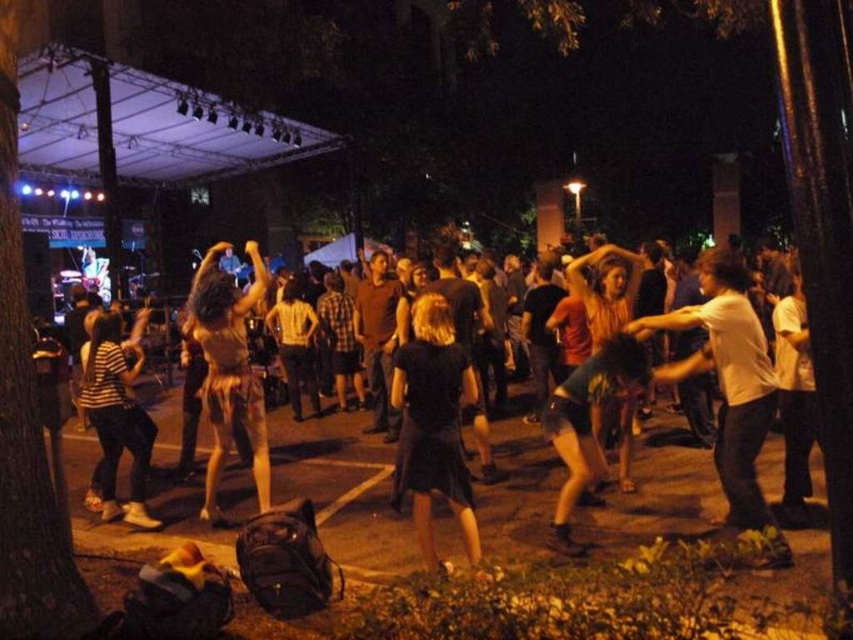
From the picture: You are standing at the center of the stage and want to find the white cotton shirt at right. In which direction should you look to see it?

The white cotton shirt at right is located at coordinates 0.603 on the x axis and 0.856 on the y axis. Since you are at the center of the stage, you should look to the right and slightly upwards to find it.

In the nighttime outdoor scene with a stage and crowd, where exactly is the black cotton dress at center located in terms of its position coordinates?

The black cotton dress at center is located at coordinates point (656, 500).